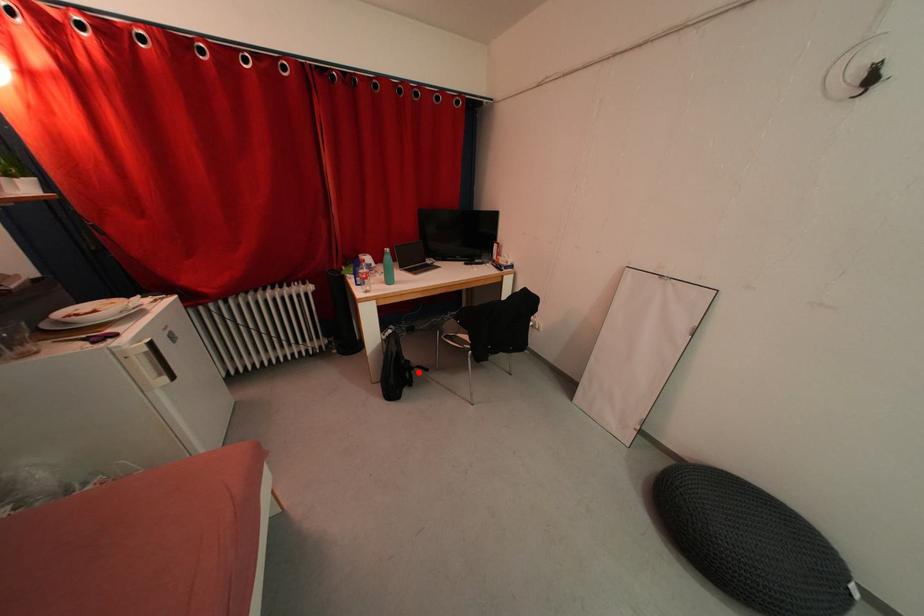
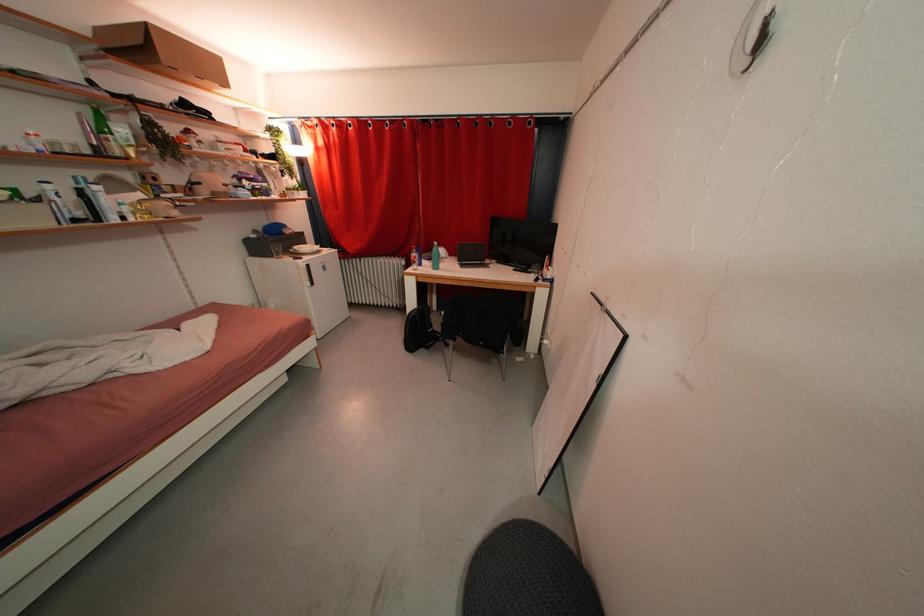
Question: I am providing you with two images of the same scene from different viewpoints. A red point is marked on the first image. Is the red point's position out of view in image 2?

Choices:
 (A) Yes
 (B) No

Answer: (B)